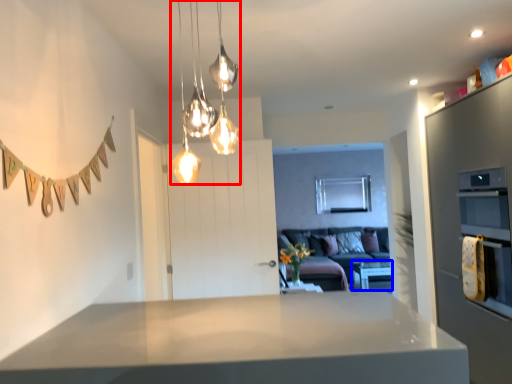
Question: Which object is further to the camera taking this photo, lamp (highlighted by a red box) or table (highlighted by a blue box)?

Choices:
 (A) lamp
 (B) table

Answer: (B)